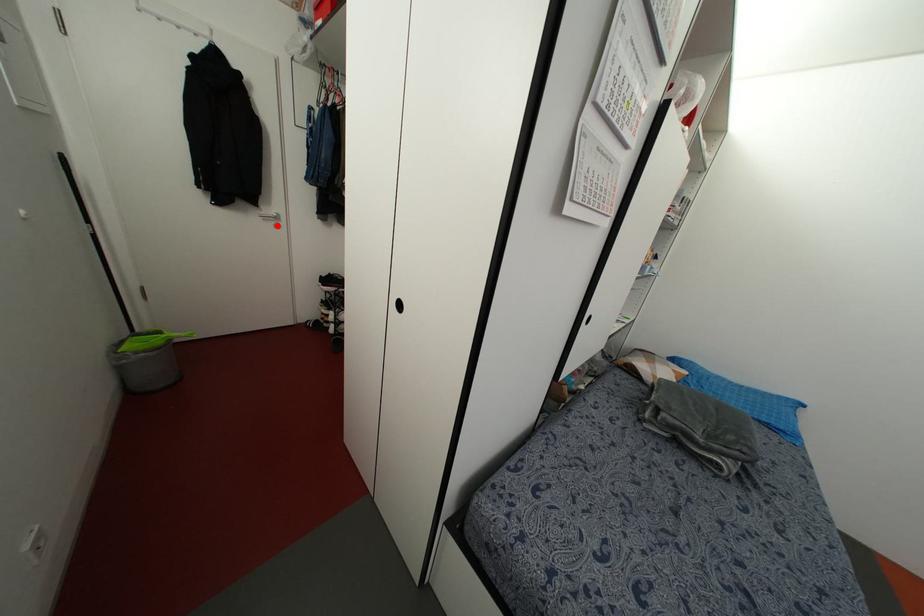
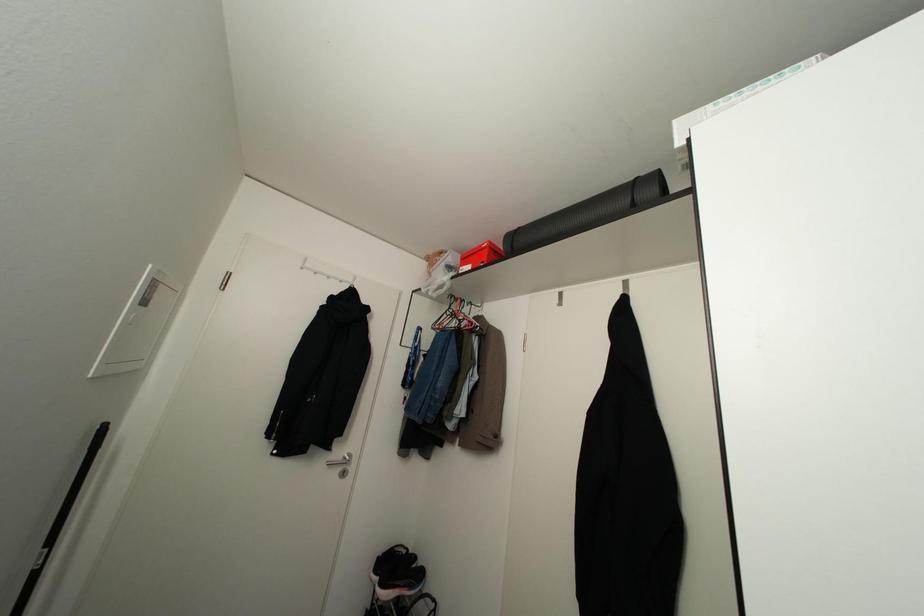
I am providing you with two images of the same scene from different viewpoints. A red point is marked on the first image and another point is marked on the second image. Is the marked point in image1 the same physical position as the marked point in image2?

No